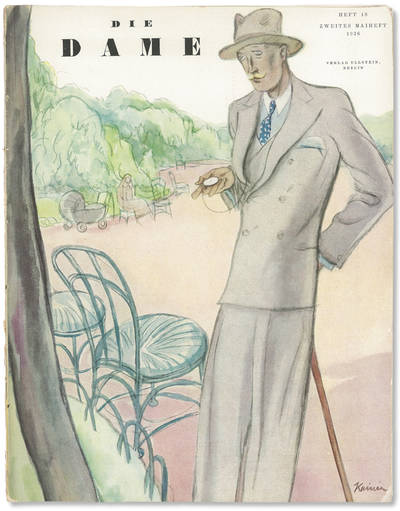
Locate an element on the screen. This screenshot has height=511, width=400. floor is located at coordinates (357, 278).